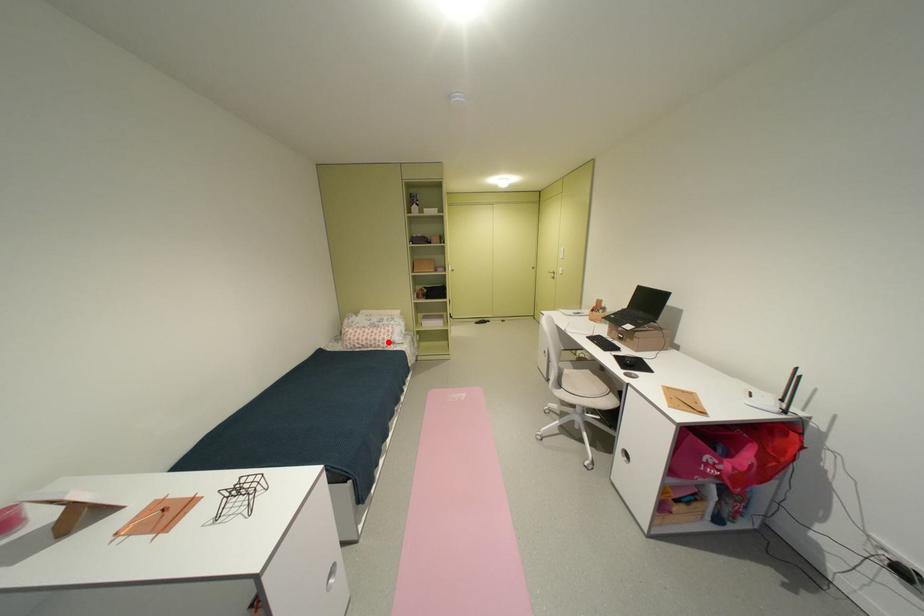
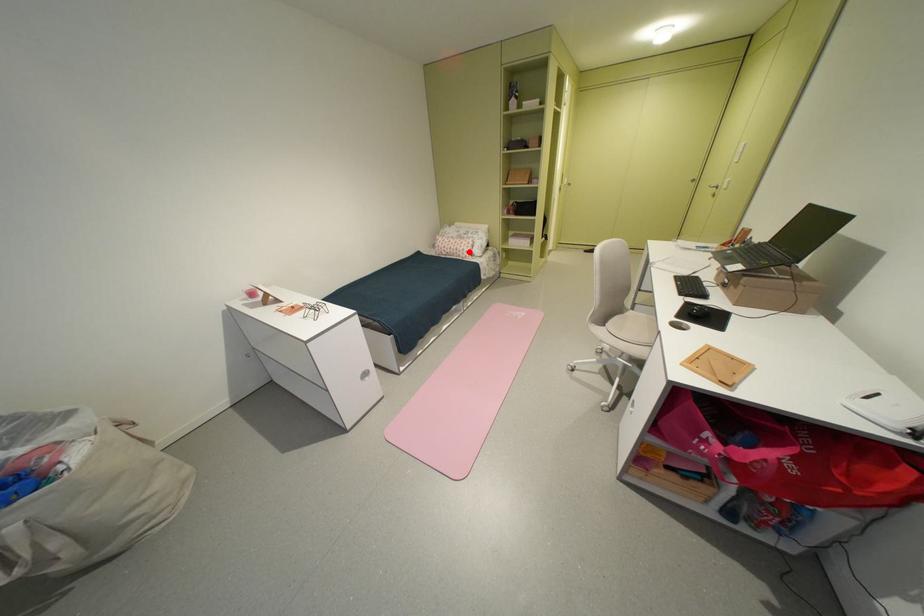
I am providing you with two images of the same scene from different viewpoints. A red point is marked on the first image and another point is marked on the second image. Are the points marked in image1 and image2 representing the same 3D position?

Yes